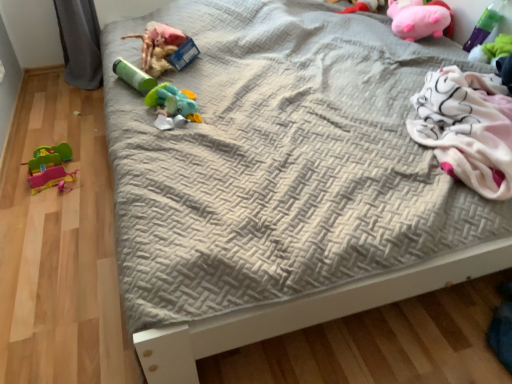
You are a GUI agent. You are given a task and a screenshot of the screen. Output one action in this format:
    pyautogui.click(x=<x>, y=<y>)
    Task: Click on the vacant space to the left of rubber duck at left, which is the seventh toy in right-to-left order
    This screenshot has width=512, height=384.
    Given the screenshot: What is the action you would take?
    pyautogui.click(x=16, y=170)